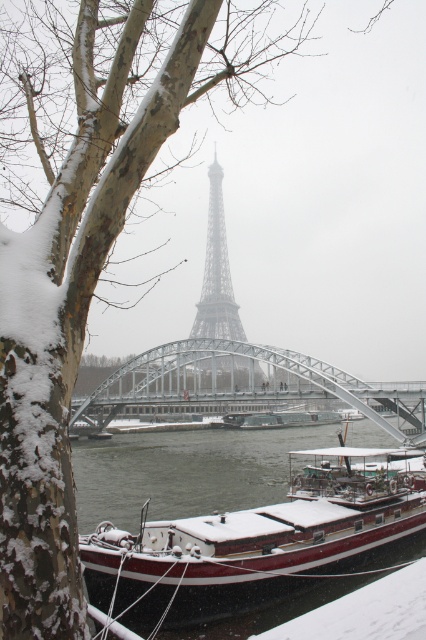
You are a tour guide leading a group to the Eiffel Tower. You see the metallic gray bridge at center and the metallic structure at center. Which one is closer to the Eiffel Tower?

Both the metallic gray bridge at center and the metallic structure at center are 65.20 feet apart from each other, so their distance to the Eiffel Tower is the same.

You are standing at the point labeled as point [241,556] in the image. Looking around, you see the snow covered tree trunk on the left and the Eiffel Tower in the foggy background. What object are you currently standing on?

The point [241,556] corresponds to the snow covered wooden boat at lower center, so you are standing on the snow covered wooden boat at lower center.